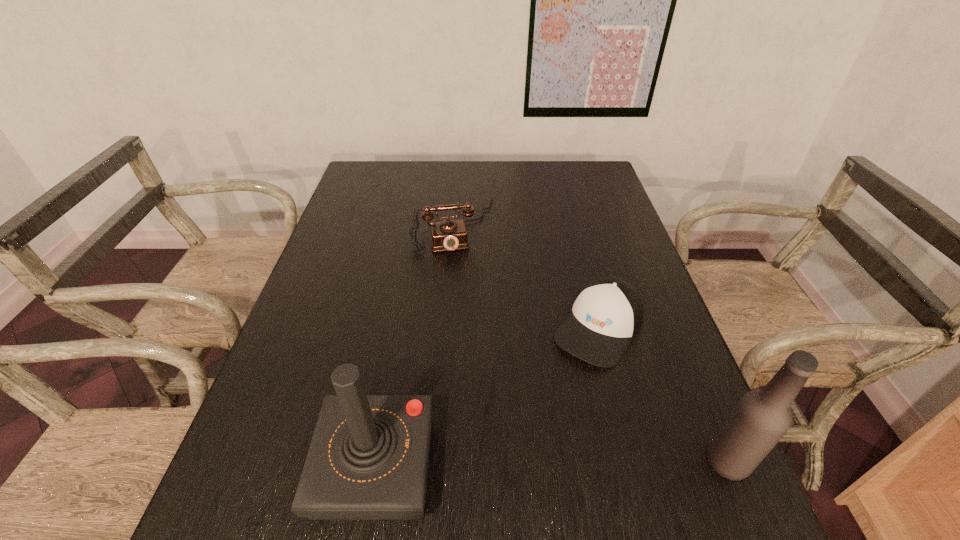
This screenshot has height=540, width=960. Find the location of `unoccupied position between the joystick and the telephone`. unoccupied position between the joystick and the telephone is located at coordinates (415, 346).

Locate an element on the screen. free area in between the farthest object and the joystick is located at coordinates (415, 346).

This screenshot has height=540, width=960. Find the location of `unoccupied area between the third object from left to right and the joystick`. unoccupied area between the third object from left to right and the joystick is located at coordinates (487, 397).

Locate an element on the screen. The image size is (960, 540). free point between the rightmost object and the joystick is located at coordinates (551, 464).

This screenshot has height=540, width=960. Identify the location of free space between the joystick and the farthest object. (415, 346).

The width and height of the screenshot is (960, 540). I want to click on empty space that is in between the joystick and the third object from left to right, so click(487, 397).

Locate an element on the screen. The image size is (960, 540). object that is the second nearest to the farthest object is located at coordinates (368, 459).

Select which object appears as the second closest to the cap. Please provide its 2D coordinates. Your answer should be formatted as a tuple, i.e. [(x, y)], where the tuple contains the x and y coordinates of a point satisfying the conditions above.

[(448, 235)]

Where is `free spot that satisfies the following two spatial constraints: 1. on the front side of the shortest object; 2. on the side of the rightmost object with the label`? Image resolution: width=960 pixels, height=540 pixels. free spot that satisfies the following two spatial constraints: 1. on the front side of the shortest object; 2. on the side of the rightmost object with the label is located at coordinates (633, 461).